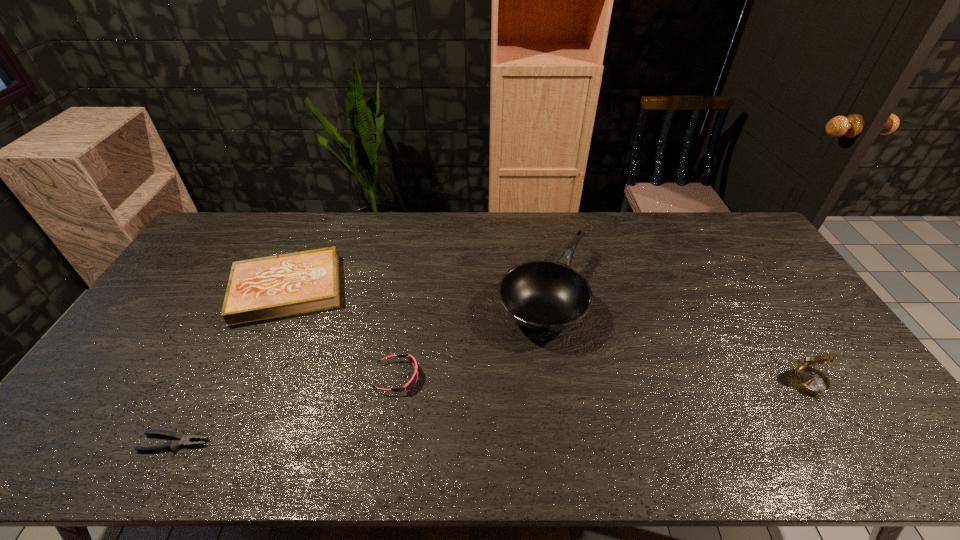
The width and height of the screenshot is (960, 540). In order to click on vacant space located 0.290m on the front-facing side of the third object from left to right in this screenshot , I will do `click(528, 377)`.

Where is `vacant point located at the gripping part of the shortest object`? The width and height of the screenshot is (960, 540). vacant point located at the gripping part of the shortest object is located at coordinates (255, 442).

This screenshot has height=540, width=960. In order to click on object located at the far edge in this screenshot , I will do `click(545, 296)`.

This screenshot has width=960, height=540. What are the coordinates of `object that is at the near edge` in the screenshot? It's located at (181, 439).

Identify the location of object that is at the right edge. Image resolution: width=960 pixels, height=540 pixels. (810, 380).

Locate an element on the screen. vacant region at the far edge of the desktop is located at coordinates (253, 239).

You are a GUI agent. You are given a task and a screenshot of the screen. Output one action in this format:
    pyautogui.click(x=<x>, y=<y>)
    Task: Click on the vacant space at the near edge of the desktop
    
    Given the screenshot: What is the action you would take?
    pyautogui.click(x=195, y=432)

At what (x,y) coordinates should I click in order to perform the action: click on vacant point at the right edge. Please return your answer as a coordinate pair (x, y). This screenshot has width=960, height=540. Looking at the image, I should click on click(x=732, y=254).

The image size is (960, 540). I want to click on vacant space at the far right corner of the desktop, so pyautogui.click(x=727, y=239).

Image resolution: width=960 pixels, height=540 pixels. What are the coordinates of `unoccupied area between the compass and the goggles` in the screenshot? It's located at (604, 381).